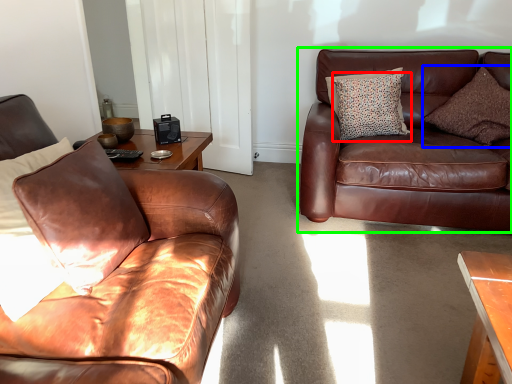
Question: Based on their relative distances, which object is farther from pillow (highlighted by a red box)? Choose from pillow (highlighted by a blue box) and studio couch (highlighted by a green box).

Choices:
 (A) pillow
 (B) studio couch

Answer: (A)